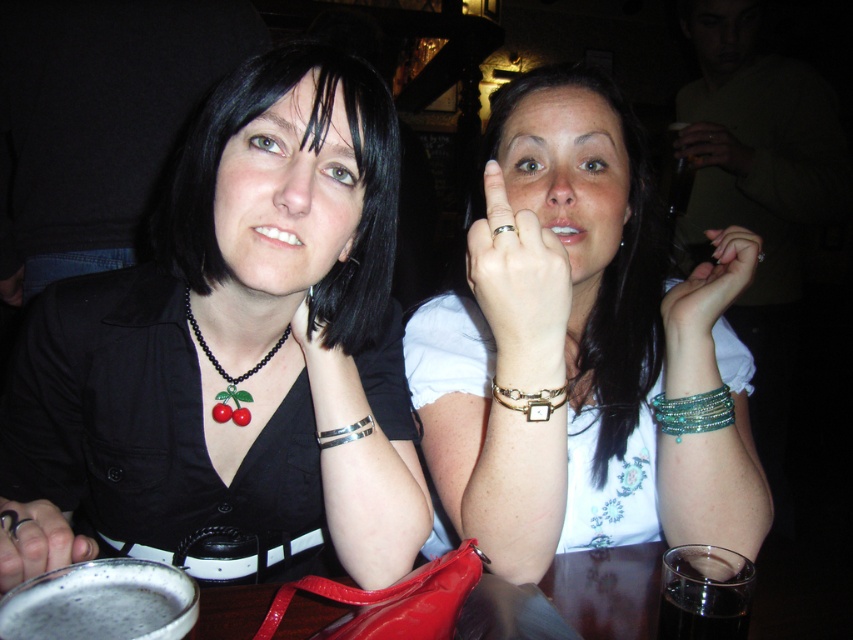
Question: Does black matte necklace at center have a smaller size compared to metallic silver bracelet at upper right?

Choices:
 (A) yes
 (B) no

Answer: (B)

Question: Which of the following is the closest to the observer?

Choices:
 (A) (61, 628)
 (B) (695, 323)
 (C) (32, 564)
 (D) (189, 310)

Answer: (A)

Question: Does foamy dark liquid at lower left have a greater width compared to metallic ring at lower left?

Choices:
 (A) no
 (B) yes

Answer: (A)

Question: Which object is closer to the camera taking this photo?

Choices:
 (A) metallic silver bracelet at upper right
 (B) foamy dark liquid at lower left
 (C) gold metallic bracelet at center
 (D) teal beaded bracelet at right

Answer: (B)

Question: Considering the real-world distances, which object is closest to the silver metallic bracelet at upper right?

Choices:
 (A) metallic ring at lower left
 (B) black matte necklace at center
 (C) black beaded necklace with cherry pendant at left
 (D) dark glass at lower right

Answer: (C)

Question: Is gold metallic ring at upper center closer to the viewer compared to black beaded necklace with cherry pendant at left?

Choices:
 (A) no
 (B) yes

Answer: (B)